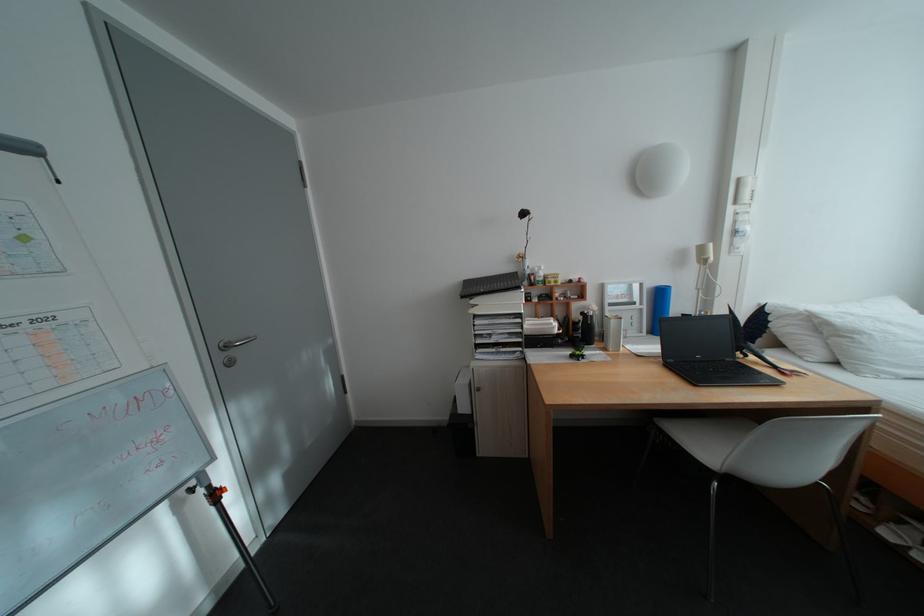
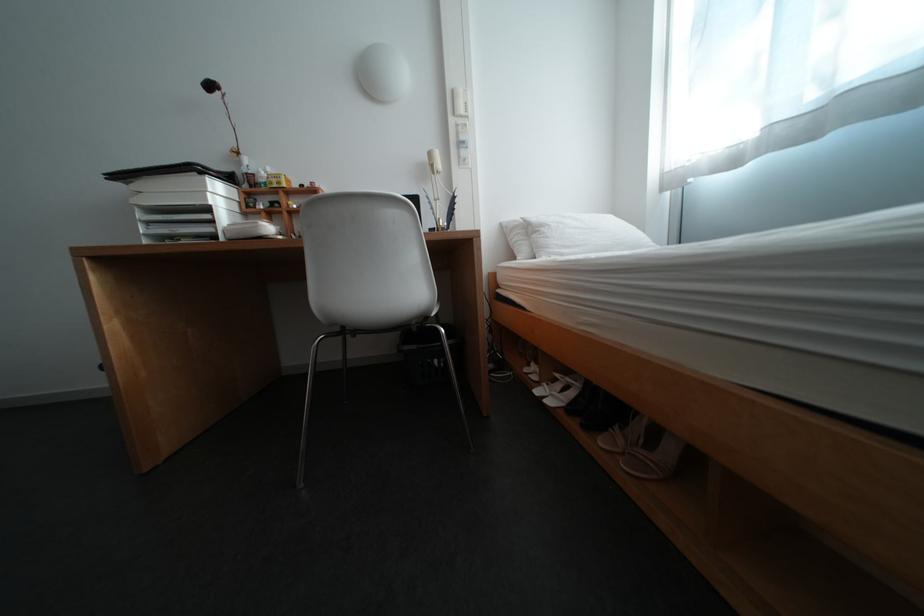
Find the pixel in the second image that matches point (751, 180) in the first image.

(466, 92)